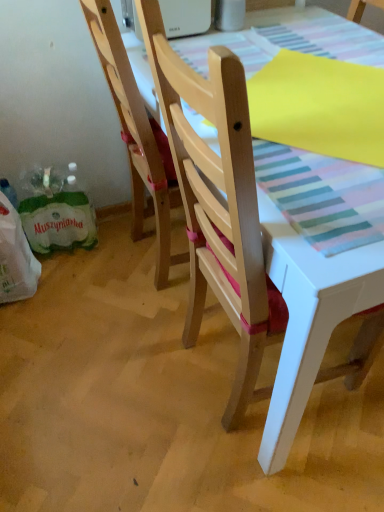
Question: Is green paper shopping bag at lower left closer to camera compared to wooden chair at center, the second chair when ordered from left to right?

Choices:
 (A) yes
 (B) no

Answer: (B)

Question: From a real-world perspective, is green paper shopping bag at lower left below wooden chair at center, the second chair when ordered from left to right?

Choices:
 (A) no
 (B) yes

Answer: (B)

Question: Does green paper shopping bag at lower left come behind wooden chair at center, the second chair when ordered from left to right?

Choices:
 (A) yes
 (B) no

Answer: (A)

Question: Can you confirm if green paper shopping bag at lower left is positioned to the left of wooden chair at center, acting as the first chair starting from the right?

Choices:
 (A) yes
 (B) no

Answer: (A)

Question: From the image's perspective, would you say green paper shopping bag at lower left is positioned over wooden chair at center, the second chair when ordered from left to right?

Choices:
 (A) no
 (B) yes

Answer: (B)

Question: Considering the positions of natural wood chair at center, the 1th chair when ordered from left to right, and green plastic grocery bag at lower left in the image, is natural wood chair at center, the 1th chair when ordered from left to right, wider or thinner than green plastic grocery bag at lower left?

Choices:
 (A) thin
 (B) wide

Answer: (B)

Question: Does point (160, 222) appear closer or farther from the camera than point (24, 279)?

Choices:
 (A) closer
 (B) farther

Answer: (A)

Question: Relative to green plastic grocery bag at lower left, is natural wood chair at center, the 1th chair when ordered from left to right, in front or behind?

Choices:
 (A) behind
 (B) front

Answer: (B)

Question: In terms of size, does natural wood chair at center, arranged as the second chair when viewed from the right, appear bigger or smaller than green plastic grocery bag at lower left?

Choices:
 (A) big
 (B) small

Answer: (A)

Question: In terms of height, does green paper shopping bag at lower left look taller or shorter compared to green plastic grocery bag at lower left?

Choices:
 (A) short
 (B) tall

Answer: (A)

Question: From the image's perspective, is green paper shopping bag at lower left above or below green plastic grocery bag at lower left?

Choices:
 (A) below
 (B) above

Answer: (B)

Question: Relative to green plastic grocery bag at lower left, is green paper shopping bag at lower left in front or behind?

Choices:
 (A) front
 (B) behind

Answer: (B)

Question: Considering the relative positions of green paper shopping bag at lower left and green plastic grocery bag at lower left in the image provided, is green paper shopping bag at lower left to the left or to the right of green plastic grocery bag at lower left?

Choices:
 (A) left
 (B) right

Answer: (B)

Question: Would you say green paper shopping bag at lower left is to the left or to the right of wooden chair at center, acting as the first chair starting from the right, in the picture?

Choices:
 (A) left
 (B) right

Answer: (A)

Question: Considering the positions of green paper shopping bag at lower left and wooden chair at center, the second chair when ordered from left to right, in the image, is green paper shopping bag at lower left taller or shorter than wooden chair at center, the second chair when ordered from left to right,?

Choices:
 (A) short
 (B) tall

Answer: (A)